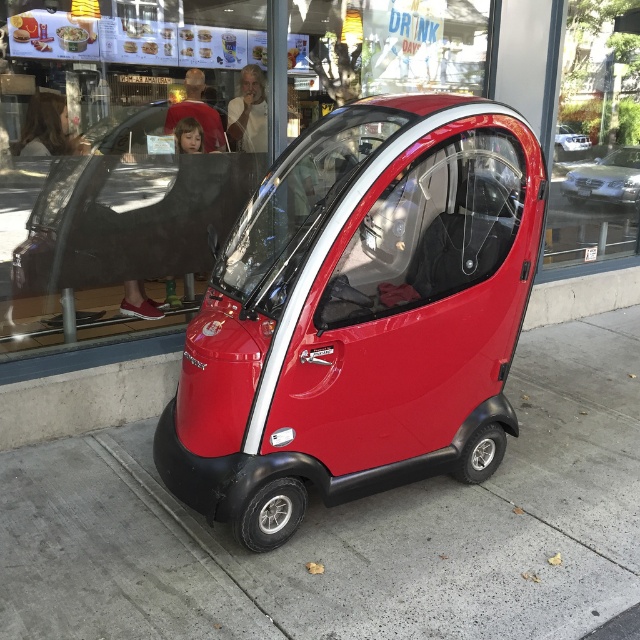
Does glossy concrete pavement at lower center have a greater width compared to metallic silver car at center?

Yes, glossy concrete pavement at lower center is wider than metallic silver car at center.

Where is `glossy concrete pavement at lower center`? glossy concrete pavement at lower center is located at coordinates (352, 529).

Is glossy red car at center closer to camera compared to metallic silver car at center?

Yes.

Between glossy red car at center and metallic silver car at center, which one appears on the left side from the viewer's perspective?

glossy red car at center is more to the left.

Find the location of a particular element. glossy red car at center is located at coordinates (360, 314).

The width and height of the screenshot is (640, 640). In order to click on glossy red car at center in this screenshot , I will do `click(360, 314)`.

Is point (12, 609) positioned before point (580, 179)?

Yes, point (12, 609) is closer to viewer.

The image size is (640, 640). In order to click on glossy concrete pavement at lower center in this screenshot , I will do `click(352, 529)`.